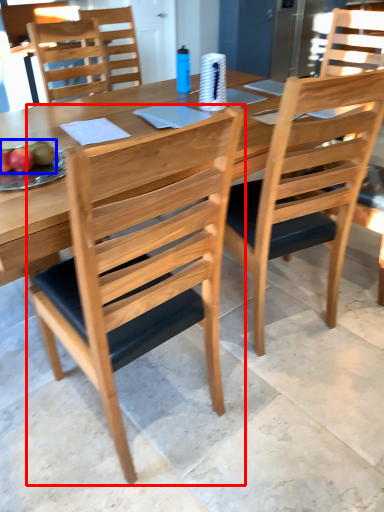
Question: Which object appears farthest to the camera in this image, chair (highlighted by a red box) or fruit (highlighted by a blue box)?

Choices:
 (A) chair
 (B) fruit

Answer: (B)